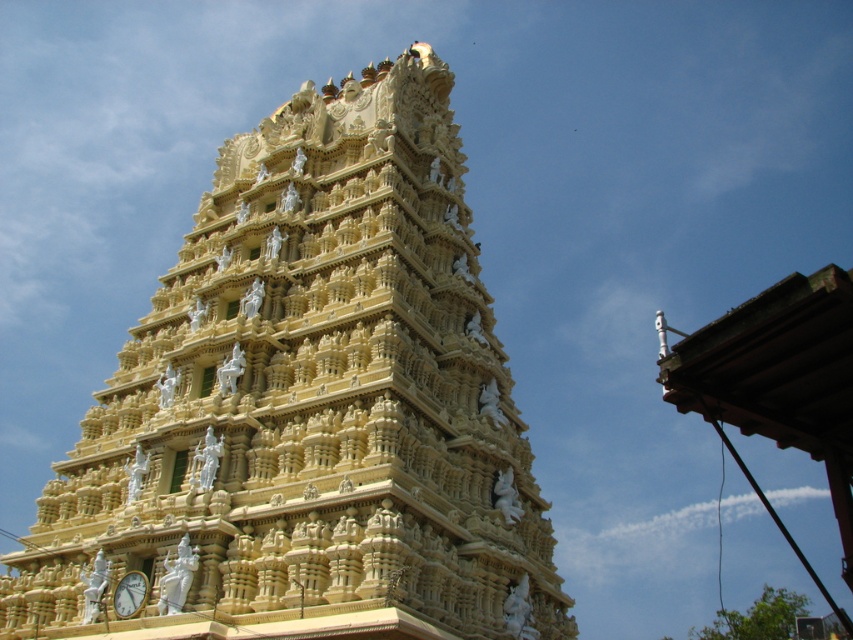
You are standing in front of the golden stone temple at center and want to look at the metallic gold clock at bottom left. Which direction should you turn your head to see it?

The golden stone temple at center is to the right of the metallic gold clock at bottom left, so you should turn your head to the left to see the metallic gold clock at bottom left.

You are standing in a temple courtyard and want to take a photo of the golden stone temple at center. You notice a metallic gold clock at bottom left nearby. Which object should you point your camera upwards to capture?

You should point your camera upwards to capture the golden stone temple at center because it is located above the metallic gold clock at bottom left.

Where is the golden stone temple at center located in the image?

The golden stone temple at center is located at point (308, 406) in the image.